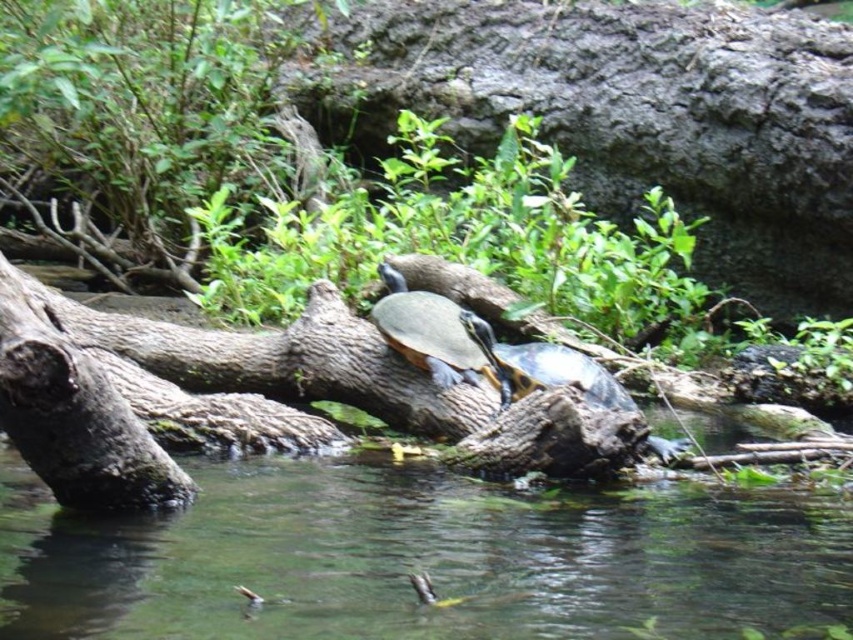
Question: Can you confirm if shiny green tortoise at center is bigger than shiny brown tortoise at center?

Choices:
 (A) yes
 (B) no

Answer: (B)

Question: Can you confirm if shiny green tortoise at center is positioned to the left of shiny brown tortoise at center?

Choices:
 (A) no
 (B) yes

Answer: (B)

Question: Which point is farther from the camera taking this photo?

Choices:
 (A) (593, 364)
 (B) (440, 378)

Answer: (B)

Question: Is shiny green tortoise at center above shiny brown tortoise at center?

Choices:
 (A) yes
 (B) no

Answer: (A)